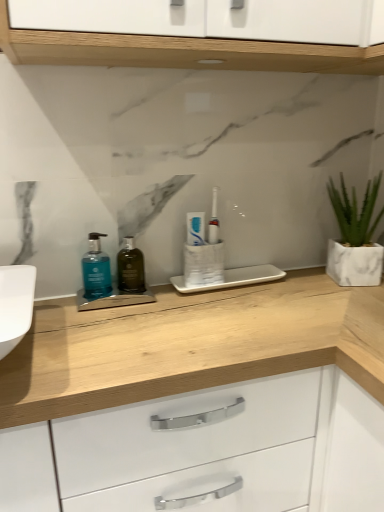
Question: Is point (130, 290) closer or farther from the camera than point (100, 273)?

Choices:
 (A) closer
 (B) farther

Answer: (B)

Question: From the image's perspective, is dark green glass bottle at center, the 1th mouthwash when ordered from right to left, located above or below blue matte liquid soap at left, which is the first mouthwash in left-to-right order?

Choices:
 (A) below
 (B) above

Answer: (A)

Question: Which object is the farthest from the white marble planter at right?

Choices:
 (A) dark green glass bottle at center, the 1th mouthwash when ordered from right to left
 (B) blue matte liquid soap at left, which is the 2th mouthwash in right-to-left order
 (C) white matte tube at center

Answer: (B)

Question: Based on their relative distances, which object is nearer to the dark green glass bottle at center, positioned as the second mouthwash in left-to-right order?

Choices:
 (A) white matte tube at center
 (B) blue matte liquid soap at left, which is the first mouthwash in left-to-right order
 (C) white marble planter at right

Answer: (B)